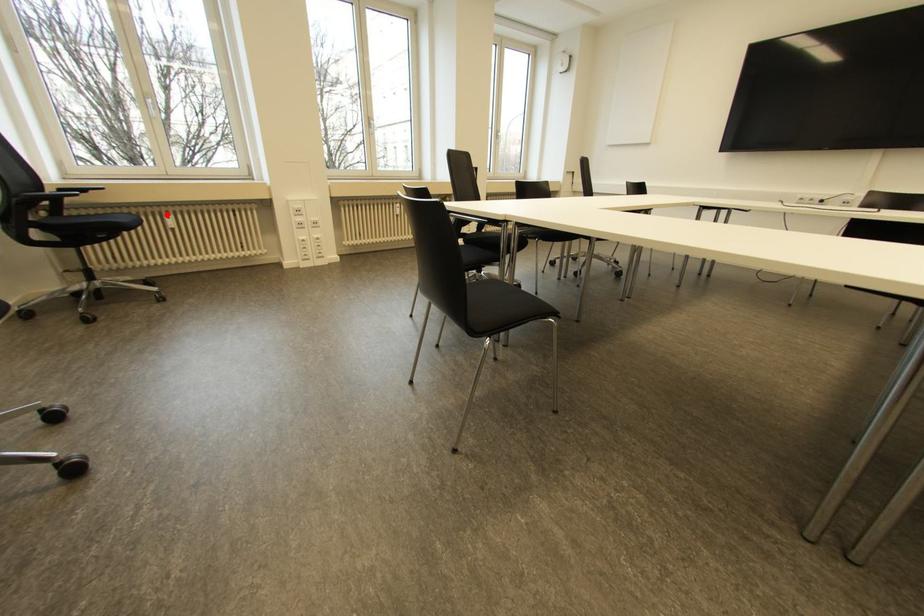
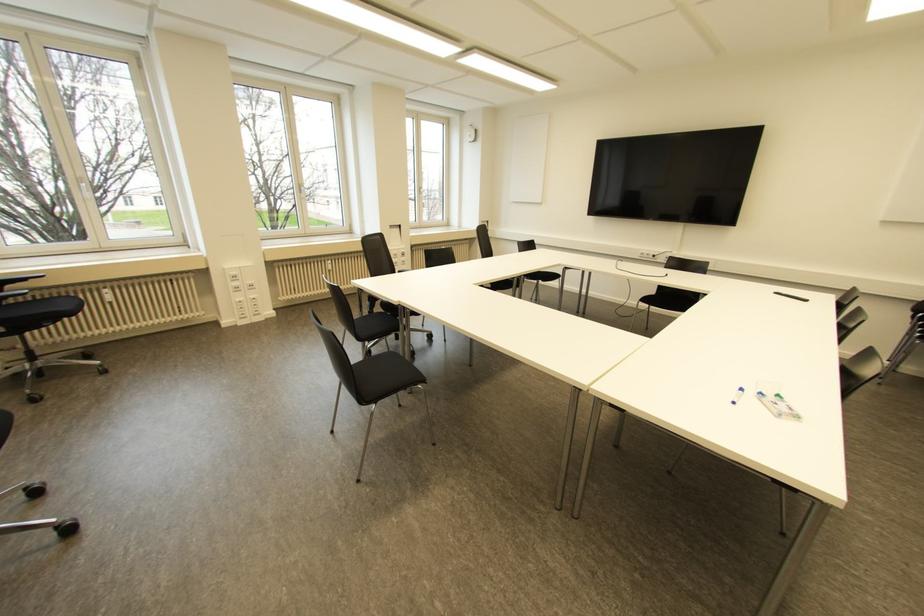
Locate, in the second image, the point that corresponds to the highlighted location in the first image.

(104, 290)